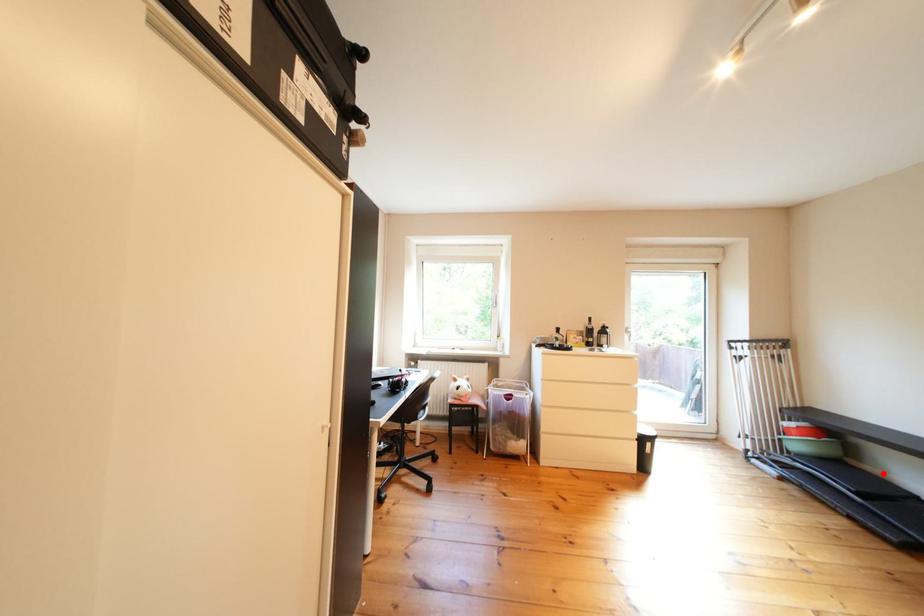
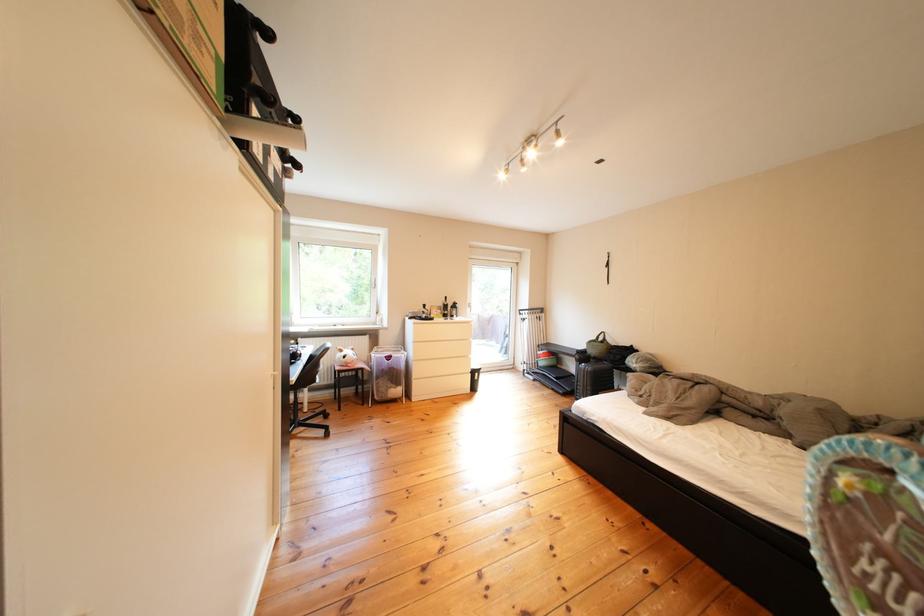
Where in the second image is the point corresponding to the highlighted location from the first image?

(578, 371)